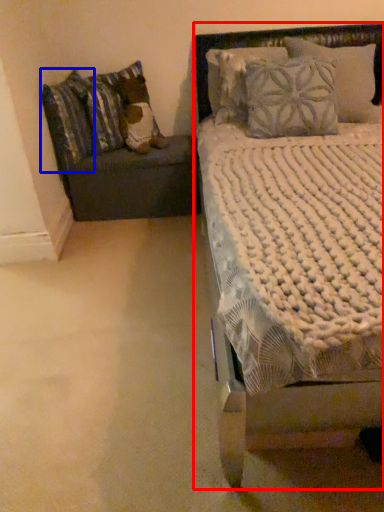
Question: Which object appears farthest to the camera in this image, bed (highlighted by a red box) or pillow (highlighted by a blue box)?

Choices:
 (A) bed
 (B) pillow

Answer: (B)